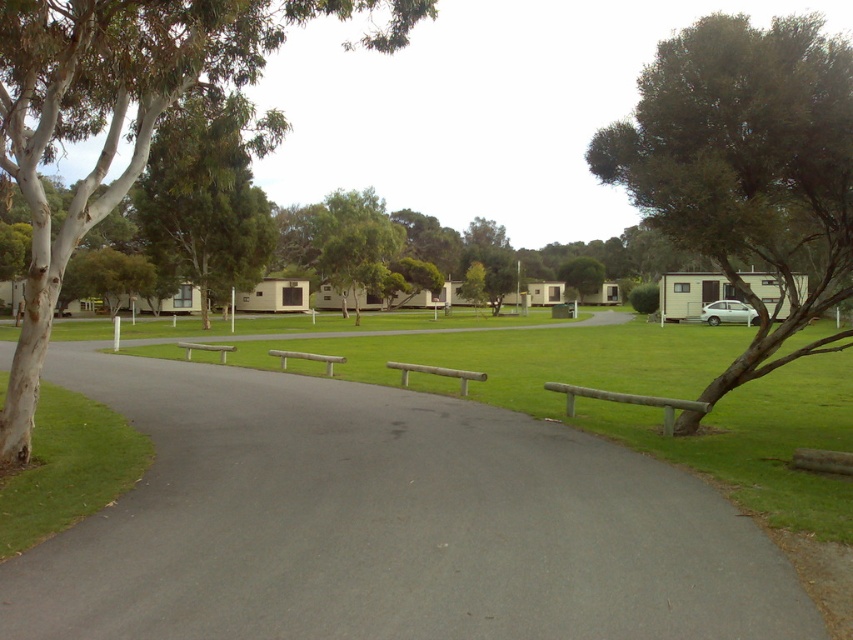
Question: Is gray asphalt driveway at center thinner than green leafy tree at upper left?

Choices:
 (A) no
 (B) yes

Answer: (B)

Question: Which of the following is the farthest from the observer?

Choices:
 (A) green leafy tree at upper right
 (B) white matte car at right
 (C) wooden park bench at center

Answer: (B)

Question: Which is farther from the light brown wooden bench at center?

Choices:
 (A) green leafy tree at center
 (B) white matte car at right
 (C) gray asphalt driveway at center
 (D) white bark tree at left

Answer: (A)

Question: Is gray asphalt driveway at center to the left of white bark tree at left from the viewer's perspective?

Choices:
 (A) yes
 (B) no

Answer: (B)

Question: Among these points, which one is nearest to the camera?

Choices:
 (A) (105, 113)
 (B) (312, 355)
 (C) (753, 371)

Answer: (C)

Question: In this image, where is green leafy tree at center located relative to white matte car at right?

Choices:
 (A) below
 (B) above

Answer: (B)